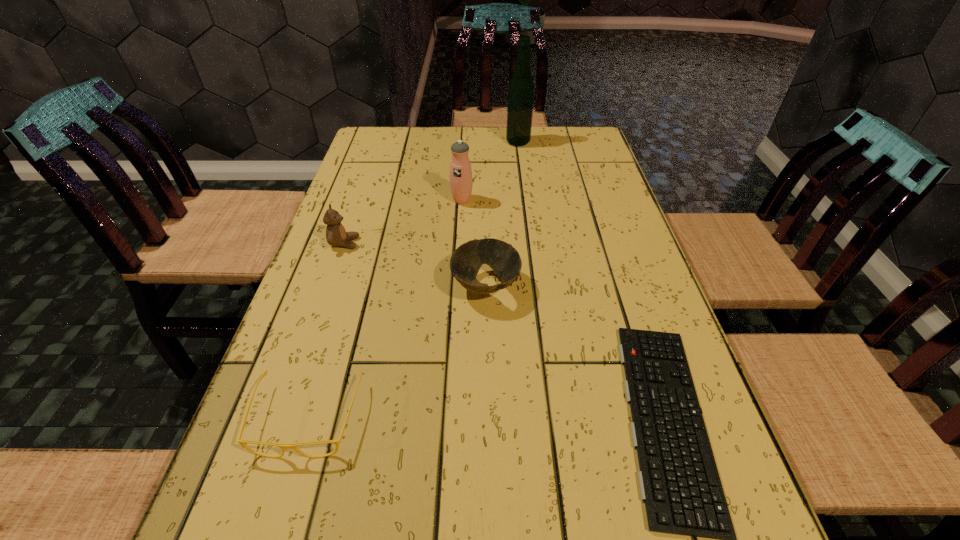
Locate an element on the screen. object that stands as the closest to the computer keyboard is located at coordinates (467, 259).

This screenshot has height=540, width=960. I want to click on vacant space that satisfies the following two spatial constraints: 1. on the back side of the fourth farthest object; 2. on the front-facing side of the fourth shortest object, so (x=485, y=243).